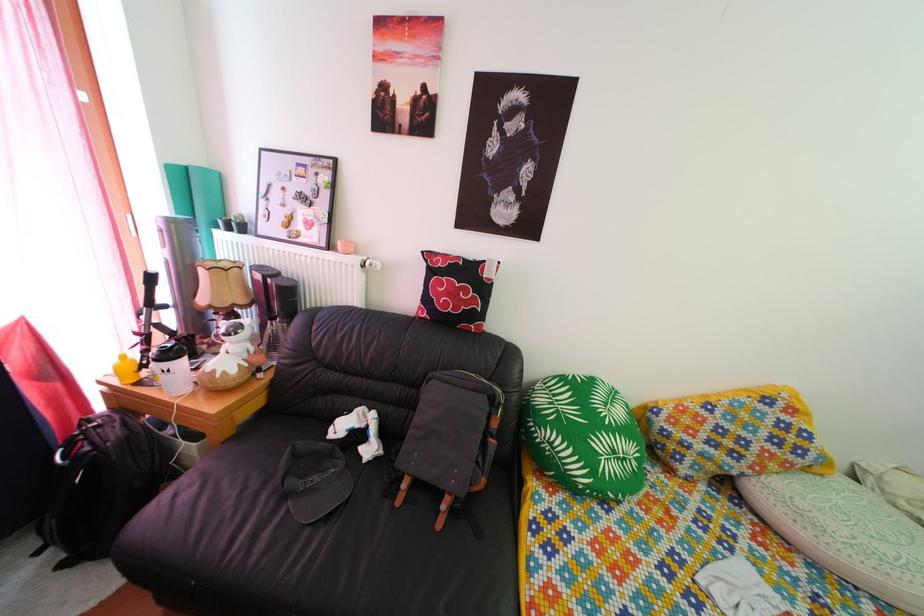
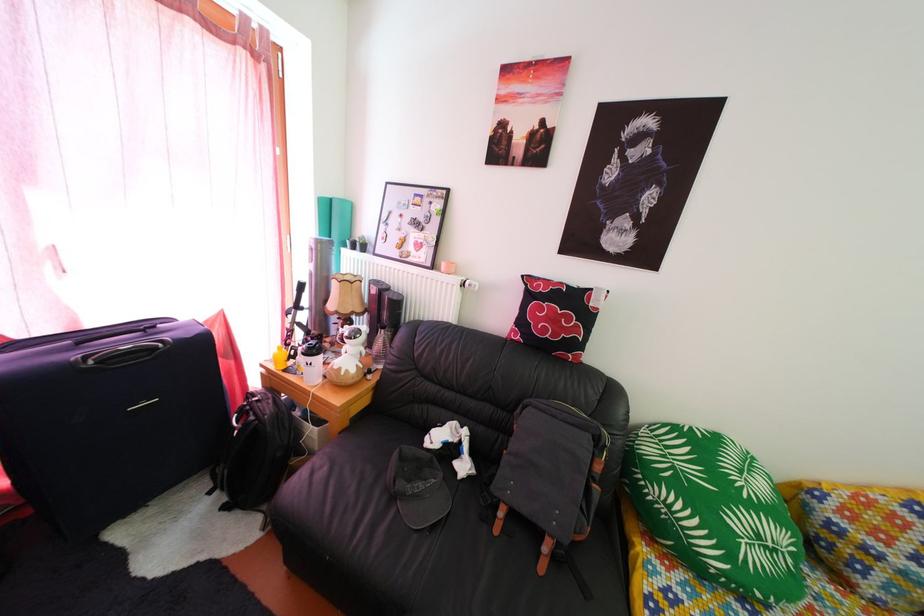
In the second image, find the point that corresponds to (127,432) in the first image.

(280, 410)